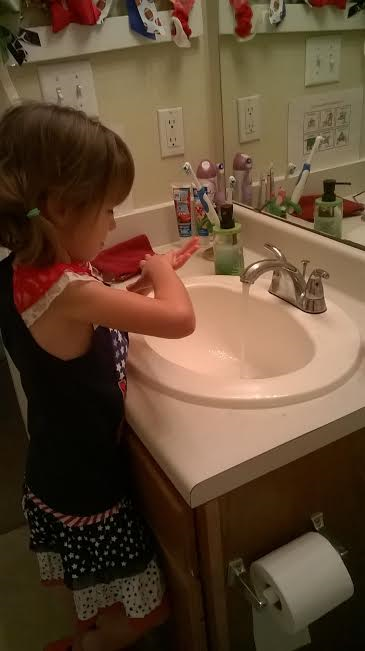
At what (x,y) coordinates should I click in order to perform the action: click on soap. Please return your answer as a coordinate pair (x, y). Image resolution: width=365 pixels, height=651 pixels. Looking at the image, I should click on (224, 252).